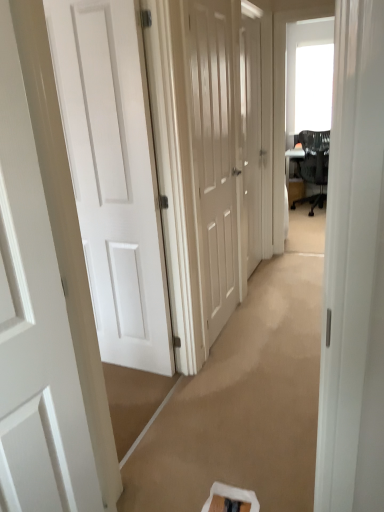
The height and width of the screenshot is (512, 384). Describe the element at coordinates (113, 175) in the screenshot. I see `white matte door at left, acting as the 2th door starting from the front` at that location.

Locate an element on the screen. This screenshot has width=384, height=512. black mesh chair at upper right is located at coordinates (313, 164).

Which is more to the right, matte white door at center, the third door viewed from the front, or white matte door at left, which is the third door in back-to-front order?

matte white door at center, the third door viewed from the front.

From the image's perspective, is matte white door at center, the third door viewed from the front, located beneath white matte door at left, which is the third door in back-to-front order?

No, from the image's perspective, matte white door at center, the third door viewed from the front, is not below white matte door at left, which is the third door in back-to-front order.

Does point (233, 124) appear closer or farther from the camera than point (99, 145)?

Clearly, point (233, 124) is more distant from the camera than point (99, 145).

From the image's perspective, is white glossy door at left, which is the fourth door in back-to-front order, under matte white door at center, which is the 2th door in back-to-front order?

Yes.

From a real-world perspective, is white glossy door at left, the first door viewed from the front, below matte white door at center, the third door viewed from the front?

Yes, from a real-world perspective, white glossy door at left, the first door viewed from the front, is under matte white door at center, the third door viewed from the front.

From the picture: Are white glossy door at left, which is the fourth door in back-to-front order, and matte white door at center, the third door viewed from the front, far apart?

white glossy door at left, which is the fourth door in back-to-front order, is positioned a significant distance from matte white door at center, the third door viewed from the front.

Where is `the 2nd door counting from the left side of the matte white door at center, which is the 2th door in back-to-front order`? the 2nd door counting from the left side of the matte white door at center, which is the 2th door in back-to-front order is located at coordinates pyautogui.click(x=34, y=326).

Where is `chair above the white matte door at left, which is the third door in back-to-front order (from the image's perspective)`? The width and height of the screenshot is (384, 512). chair above the white matte door at left, which is the third door in back-to-front order (from the image's perspective) is located at coordinates (313, 164).

Is black mesh chair at upper right beside white matte door at left, which is the third door in back-to-front order?

No, black mesh chair at upper right is not touching white matte door at left, which is the third door in back-to-front order.

Does black mesh chair at upper right have a lesser height compared to white matte door at left, which is the third door in back-to-front order?

Yes, black mesh chair at upper right is shorter than white matte door at left, which is the third door in back-to-front order.

Does point (312, 173) lie behind point (74, 129)?

Yes, point (312, 173) is farther from viewer.

Is white matte door at left, which is the third door in back-to-front order, far from white glossy door at center, which appears as the 1th door when viewed from the back?

Yes.

From the image's perspective, would you say white matte door at left, which is the third door in back-to-front order, is positioned over white glossy door at center, which appears as the 1th door when viewed from the back?

Actually, white matte door at left, which is the third door in back-to-front order, appears below white glossy door at center, which appears as the 1th door when viewed from the back, in the image.

Does point (167, 303) lie in front of point (246, 47)?

Yes.

Based on the photo, is white matte door at left, acting as the 2th door starting from the front, spatially inside white glossy door at center, which is the 4th door in front-to-back order, or outside of it?

white matte door at left, acting as the 2th door starting from the front, is not enclosed by white glossy door at center, which is the 4th door in front-to-back order.

Considering the sizes of objects white glossy door at left, the first door viewed from the front, and white glossy door at center, which is the 4th door in front-to-back order, in the image provided, who is wider, white glossy door at left, the first door viewed from the front, or white glossy door at center, which is the 4th door in front-to-back order,?

white glossy door at left, the first door viewed from the front.

In terms of height, does white glossy door at left, which is the fourth door in back-to-front order, look taller or shorter compared to white glossy door at center, which is the 4th door in front-to-back order?

Considering their sizes, white glossy door at left, which is the fourth door in back-to-front order, has less height than white glossy door at center, which is the 4th door in front-to-back order.

From the image's perspective, is white glossy door at left, the first door viewed from the front, located above white glossy door at center, which appears as the 1th door when viewed from the back?

No, from the image's perspective, white glossy door at left, the first door viewed from the front, is not on top of white glossy door at center, which appears as the 1th door when viewed from the back.

Between white glossy door at left, the first door viewed from the front, and white glossy door at center, which appears as the 1th door when viewed from the back, which one appears on the left side from the viewer's perspective?

From the viewer's perspective, white glossy door at left, the first door viewed from the front, appears more on the left side.

Is white glossy door at center, which appears as the 1th door when viewed from the back, in front of white glossy door at left, which is the fourth door in back-to-front order?

No, the depth of white glossy door at center, which appears as the 1th door when viewed from the back, is greater than that of white glossy door at left, which is the fourth door in back-to-front order.

Between white glossy door at center, which is the 4th door in front-to-back order, and white glossy door at left, the first door viewed from the front, which one has larger size?

white glossy door at center, which is the 4th door in front-to-back order.

From a real-world perspective, is white glossy door at center, which appears as the 1th door when viewed from the back, under white glossy door at left, which is the fourth door in back-to-front order?

Actually, white glossy door at center, which appears as the 1th door when viewed from the back, is physically above white glossy door at left, which is the fourth door in back-to-front order, in the real world.

Does point (243, 184) appear closer or farther from the camera than point (78, 434)?

Point (243, 184) is farther from the camera than point (78, 434).

Which of these two, white glossy door at center, which is the 4th door in front-to-back order, or black mesh chair at upper right, is thinner?

white glossy door at center, which is the 4th door in front-to-back order.

Identify the location of chair below the white glossy door at center, which appears as the 1th door when viewed from the back (from a real-world perspective). This screenshot has height=512, width=384. (313, 164).

From a real-world perspective, who is located lower, white glossy door at center, which appears as the 1th door when viewed from the back, or black mesh chair at upper right?

black mesh chair at upper right is physically lower.

Would you say white glossy door at center, which appears as the 1th door when viewed from the back, contains black mesh chair at upper right?

Actually, black mesh chair at upper right is outside white glossy door at center, which appears as the 1th door when viewed from the back.

From a real-world perspective, starting from the white matte door at left, acting as the 2th door starting from the front, which door is the 2nd one vertically above it? Please provide its 2D coordinates.

[(215, 148)]

From the matte white door at center, the third door viewed from the front, count 2nd doors forward and point to it. Please provide its 2D coordinates.

[(34, 326)]

Based on their spatial positions, is white matte door at left, which is the third door in back-to-front order, or white glossy door at center, which is the 4th door in front-to-back order, further from black mesh chair at upper right?

white matte door at left, which is the third door in back-to-front order, lies further to black mesh chair at upper right than the other object.

Considering their positions, is matte white door at center, which is the 2th door in back-to-front order, positioned further to black mesh chair at upper right than white matte door at left, which is the third door in back-to-front order?

white matte door at left, which is the third door in back-to-front order.

Which object lies nearer to the anchor point white glossy door at left, which is the fourth door in back-to-front order, black mesh chair at upper right or matte white door at center, which is the 2th door in back-to-front order?

matte white door at center, which is the 2th door in back-to-front order, is closer to white glossy door at left, which is the fourth door in back-to-front order.

Looking at the image, which one is located closer to white matte door at left, which is the third door in back-to-front order, black mesh chair at upper right or white glossy door at center, which appears as the 1th door when viewed from the back?

white glossy door at center, which appears as the 1th door when viewed from the back, is positioned closer to the anchor white matte door at left, which is the third door in back-to-front order.

Estimate the real-world distances between objects in this image. Which object is further from white glossy door at left, which is the fourth door in back-to-front order, white matte door at left, which is the third door in back-to-front order, or matte white door at center, the third door viewed from the front?

Among the two, matte white door at center, the third door viewed from the front, is located further to white glossy door at left, which is the fourth door in back-to-front order.

From the image, which object appears to be nearer to black mesh chair at upper right, white glossy door at left, which is the fourth door in back-to-front order, or matte white door at center, which is the 2th door in back-to-front order?

matte white door at center, which is the 2th door in back-to-front order, lies closer to black mesh chair at upper right than the other object.

When comparing their distances from matte white door at center, the third door viewed from the front, does white glossy door at center, which appears as the 1th door when viewed from the back, or black mesh chair at upper right seem closer?

Based on the image, white glossy door at center, which appears as the 1th door when viewed from the back, appears to be nearer to matte white door at center, the third door viewed from the front.

Estimate the real-world distances between objects in this image. Which object is further from matte white door at center, which is the 2th door in back-to-front order, white glossy door at left, which is the fourth door in back-to-front order, or white matte door at left, which is the third door in back-to-front order?

Based on the image, white glossy door at left, which is the fourth door in back-to-front order, appears to be further to matte white door at center, which is the 2th door in back-to-front order.

This screenshot has height=512, width=384. I want to click on door located between white matte door at left, acting as the 2th door starting from the front, and white glossy door at center, which is the 4th door in front-to-back order, in the depth direction, so click(x=215, y=148).

The height and width of the screenshot is (512, 384). What are the coordinates of `door between matte white door at center, the third door viewed from the front, and black mesh chair at upper right from front to back` in the screenshot? It's located at (252, 137).

Where is `door between white glossy door at left, which is the fourth door in back-to-front order, and matte white door at center, which is the 2th door in back-to-front order, along the z-axis`? This screenshot has height=512, width=384. door between white glossy door at left, which is the fourth door in back-to-front order, and matte white door at center, which is the 2th door in back-to-front order, along the z-axis is located at coordinates (113, 175).